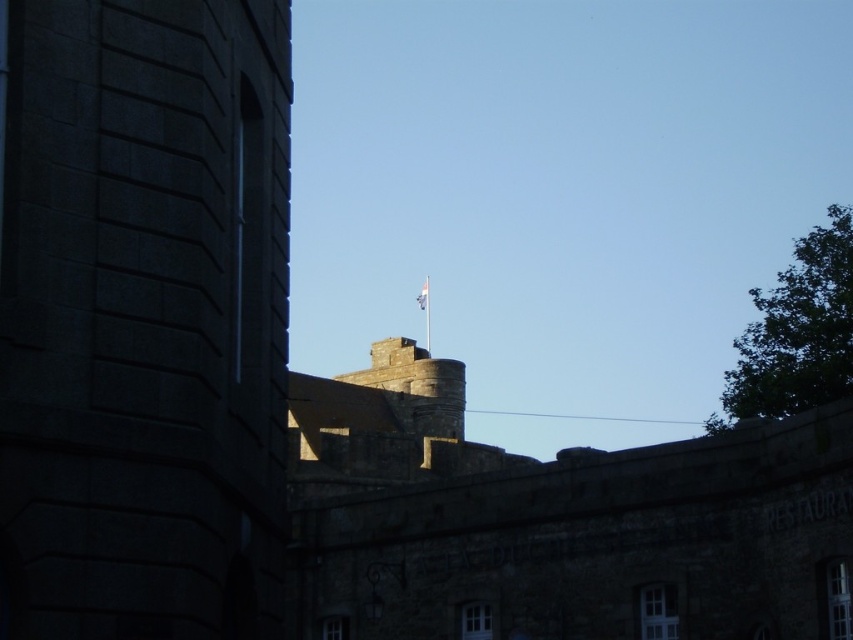
Question: Which point is farther to the camera?

Choices:
 (A) (426, 289)
 (B) (80, 241)

Answer: (A)

Question: Does dark stone tower at left appear over white fabric flag at upper center?

Choices:
 (A) no
 (B) yes

Answer: (A)

Question: Is dark stone tower at left wider than white fabric flag at upper center?

Choices:
 (A) no
 (B) yes

Answer: (B)

Question: Among these objects, which one is farthest from the camera?

Choices:
 (A) white fabric flag at upper center
 (B) dark stone tower at left

Answer: (A)

Question: Is dark stone tower at left wider than white fabric flag at upper center?

Choices:
 (A) yes
 (B) no

Answer: (A)